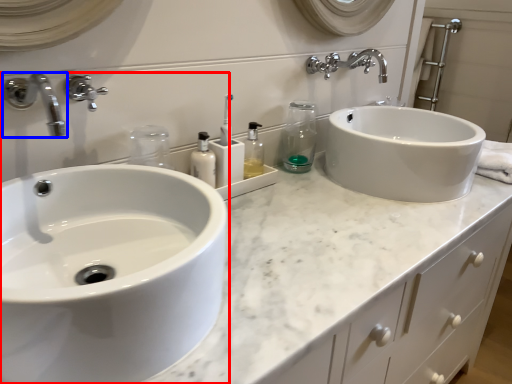
Question: Which of the following is the farthest to the observer, sink (highlighted by a red box) or tap (highlighted by a blue box)?

Choices:
 (A) sink
 (B) tap

Answer: (B)